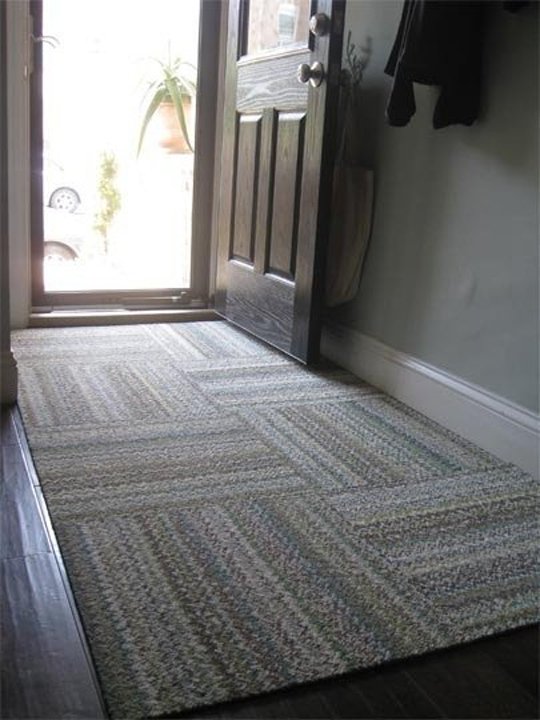
Locate an element on the screen. carpet squares is located at coordinates (116, 343), (197, 336), (125, 399), (243, 381), (168, 476), (323, 449), (267, 582), (444, 546).